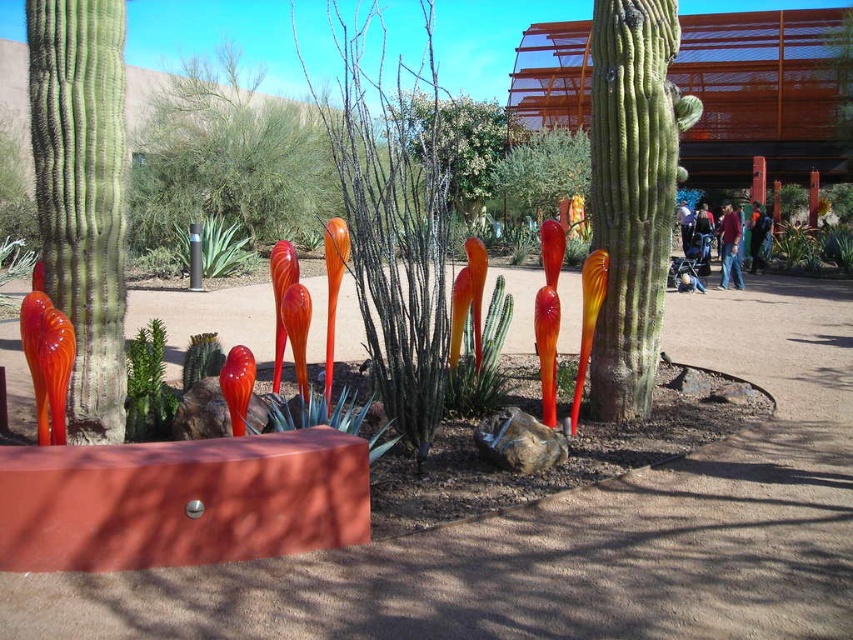
Question: Is green matte plant at center positioned before translucent glass cactus at center?

Choices:
 (A) yes
 (B) no

Answer: (B)

Question: Does translucent glass cactus at center appear on the left side of green succulent at center?

Choices:
 (A) yes
 (B) no

Answer: (B)

Question: Among these points, which one is farthest from the camera?

Choices:
 (A) (345, 417)
 (B) (224, 228)
 (C) (454, 410)
 (D) (143, 378)

Answer: (B)

Question: Which point is closer to the camera?

Choices:
 (A) (134, 385)
 (B) (303, 406)

Answer: (B)

Question: Does green leafy plant at center have a greater width compared to green succulent at center?

Choices:
 (A) yes
 (B) no

Answer: (A)

Question: Which point is farther from the camera taking this photo?

Choices:
 (A) (138, 362)
 (B) (354, 400)
 (C) (190, 349)
 (D) (450, 349)

Answer: (D)